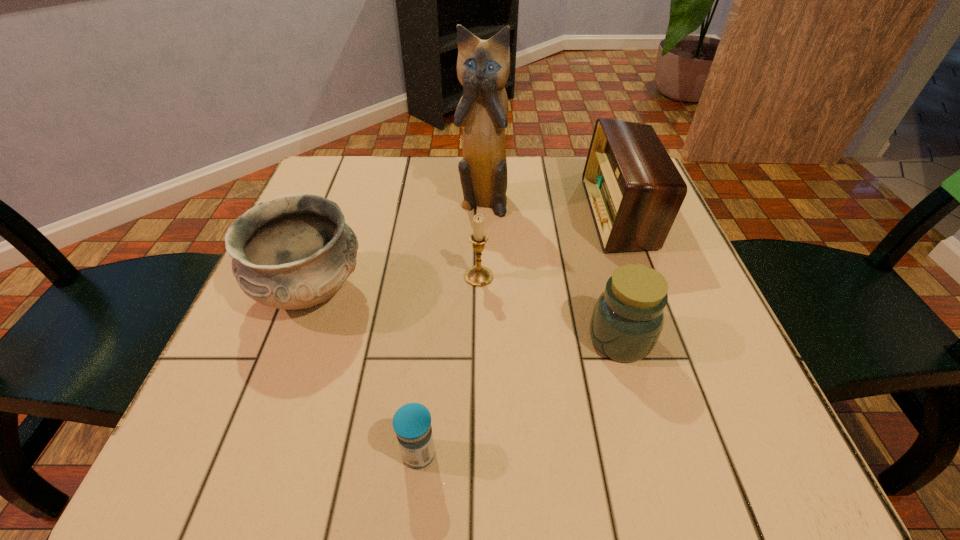
This screenshot has width=960, height=540. In order to click on jar that is at the right edge in this screenshot , I will do `click(628, 317)`.

Where is `object at the far right corner`? The width and height of the screenshot is (960, 540). object at the far right corner is located at coordinates (634, 190).

In the image, there is a desktop. In order to click on vacant space at the far edge in this screenshot , I will do `click(523, 201)`.

Find the location of a particular element. free space at the near edge is located at coordinates (525, 457).

Identify the location of free location at the left edge of the desktop. The height and width of the screenshot is (540, 960). (244, 406).

What are the coordinates of `blank area at the right edge` in the screenshot? It's located at (682, 241).

Find the location of a particular element. The width and height of the screenshot is (960, 540). vacant space at the near left corner is located at coordinates (228, 465).

Locate an element on the screen. vacant area at the near right corner is located at coordinates (660, 433).

The height and width of the screenshot is (540, 960). I want to click on empty location between the nearest object and the tallest object, so click(451, 327).

The height and width of the screenshot is (540, 960). Find the location of `vacant space that is in between the medicine and the jar`. vacant space that is in between the medicine and the jar is located at coordinates (519, 396).